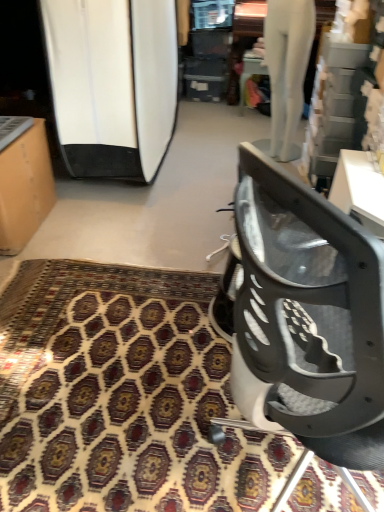
Question: Is matte cardboard box at left positioned before metallic gray chair at lower right?

Choices:
 (A) no
 (B) yes

Answer: (A)

Question: From the image's perspective, does matte cardboard box at left appear lower than metallic gray chair at lower right?

Choices:
 (A) yes
 (B) no

Answer: (B)

Question: Considering the relative sizes of matte cardboard box at left and metallic gray chair at lower right in the image provided, is matte cardboard box at left shorter than metallic gray chair at lower right?

Choices:
 (A) no
 (B) yes

Answer: (B)

Question: Does matte cardboard box at left have a greater height compared to metallic gray chair at lower right?

Choices:
 (A) yes
 (B) no

Answer: (B)

Question: Is matte cardboard box at left positioned with its back to metallic gray chair at lower right?

Choices:
 (A) no
 (B) yes

Answer: (A)

Question: From the image's perspective, is matte cardboard box at left located above or below white glossy surfboard at left?

Choices:
 (A) above
 (B) below

Answer: (B)

Question: From their relative heights in the image, would you say matte cardboard box at left is taller or shorter than white glossy surfboard at left?

Choices:
 (A) short
 (B) tall

Answer: (A)

Question: From a real-world perspective, is matte cardboard box at left positioned above or below white glossy surfboard at left?

Choices:
 (A) above
 (B) below

Answer: (B)

Question: Is point (3, 182) positioned closer to the camera than point (104, 156)?

Choices:
 (A) farther
 (B) closer

Answer: (B)

Question: Does point (208, 382) appear closer or farther from the camera than point (317, 429)?

Choices:
 (A) farther
 (B) closer

Answer: (A)

Question: Is patterned carpet at center taller or shorter than metallic gray chair at lower right?

Choices:
 (A) short
 (B) tall

Answer: (A)

Question: Choose the correct answer: Is patterned carpet at center inside metallic gray chair at lower right or outside it?

Choices:
 (A) inside
 (B) outside

Answer: (B)

Question: Visually, is patterned carpet at center positioned to the left or to the right of metallic gray chair at lower right?

Choices:
 (A) right
 (B) left

Answer: (B)

Question: From the image's perspective, is white glossy surfboard at left located above or below patterned carpet at center?

Choices:
 (A) above
 (B) below

Answer: (A)

Question: Is white glossy surfboard at left in front of or behind patterned carpet at center in the image?

Choices:
 (A) behind
 (B) front

Answer: (A)